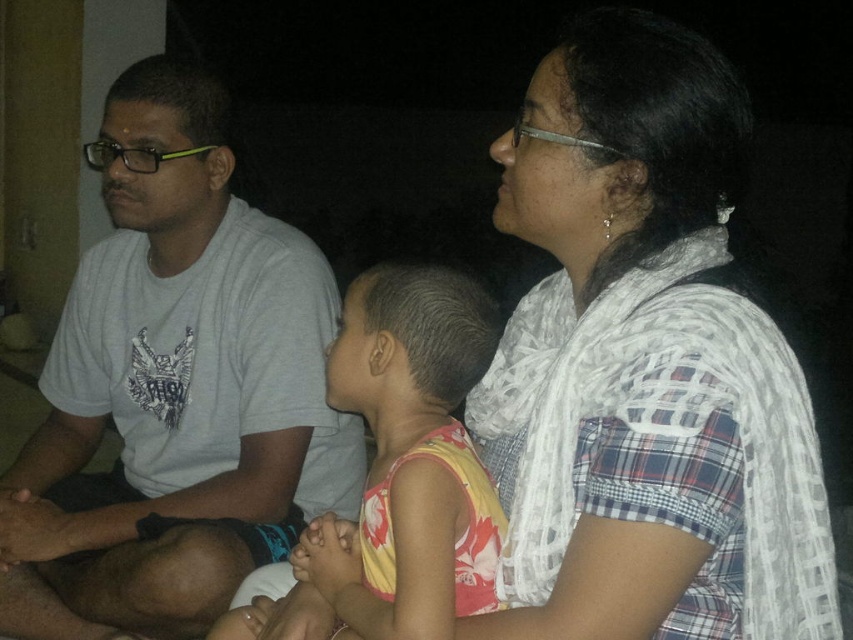
The image size is (853, 640). Describe the element at coordinates (178, 380) in the screenshot. I see `gray cotton t-shirt at left` at that location.

Does gray cotton t-shirt at left appear on the left side of floral fabric dress at center?

Indeed, gray cotton t-shirt at left is positioned on the left side of floral fabric dress at center.

Who is more forward, [271,396] or [355,550]?

Positioned in front is point [355,550].

This screenshot has width=853, height=640. I want to click on gray cotton t-shirt at left, so click(178, 380).

The height and width of the screenshot is (640, 853). Describe the element at coordinates (643, 365) in the screenshot. I see `white plaid shirt at center` at that location.

This screenshot has height=640, width=853. I want to click on white plaid shirt at center, so click(x=643, y=365).

Identify the location of white plaid shirt at center. This screenshot has height=640, width=853. (643, 365).

Is white plaid shirt at center to the right of floral fabric dress at center from the viewer's perspective?

Correct, you'll find white plaid shirt at center to the right of floral fabric dress at center.

Based on the photo, which of these two, white plaid shirt at center or floral fabric dress at center, stands taller?

white plaid shirt at center is taller.

Find the location of a particular element. This screenshot has height=640, width=853. white plaid shirt at center is located at coordinates (643, 365).